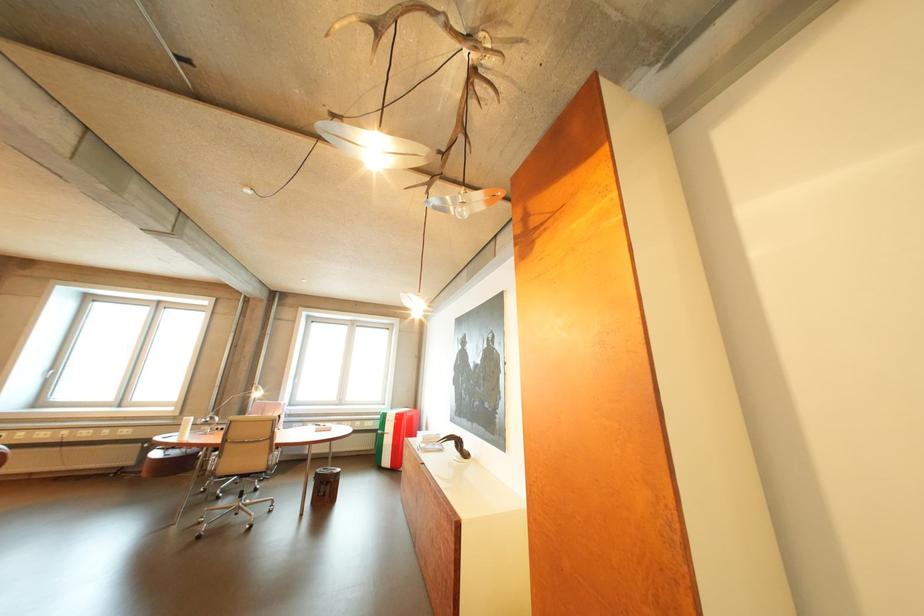
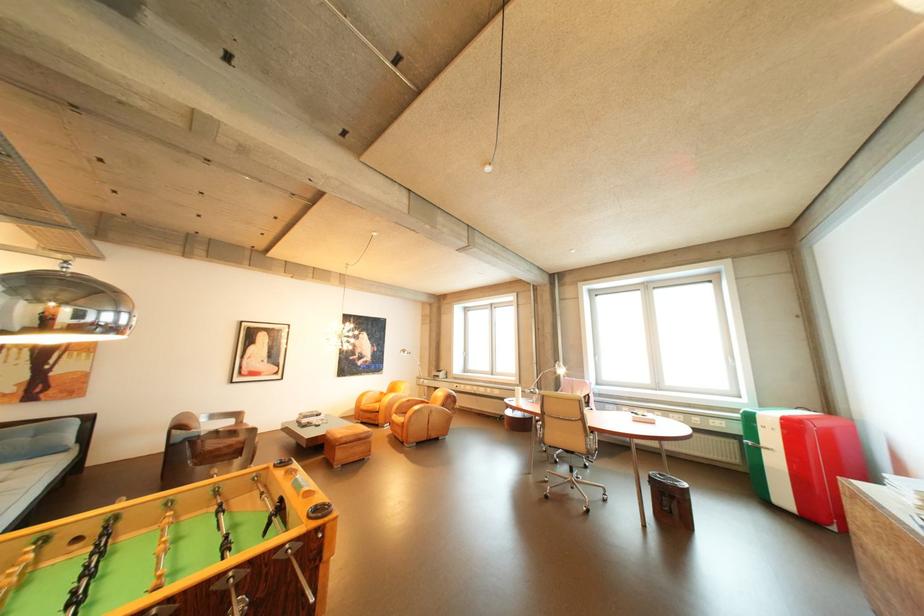
Question: The camera is either moving clockwise (left) or counter-clockwise (right) around the object. The first image is from the beginning of the video and the second image is from the end. Is the camera moving left or right when shooting the video?

Choices:
 (A) Left
 (B) Right

Answer: (B)